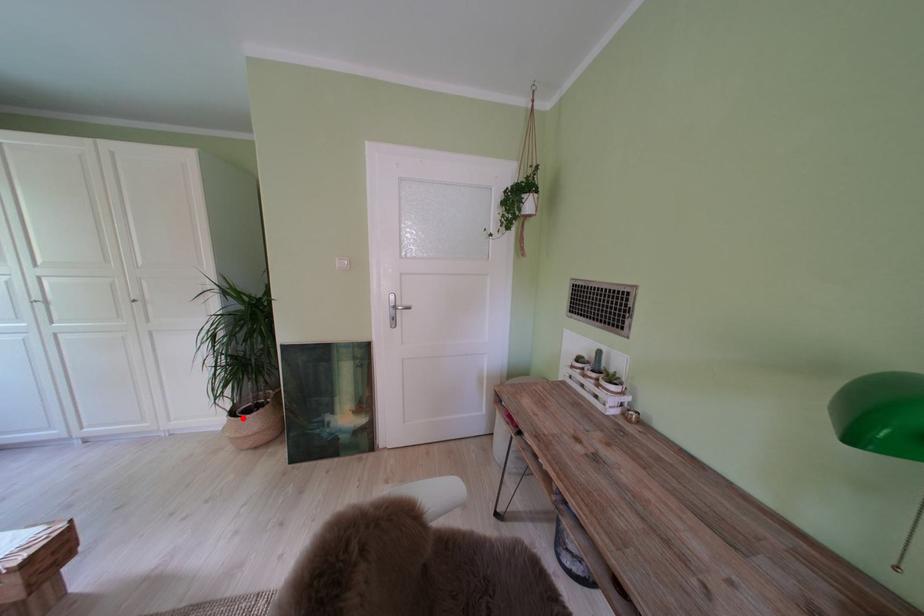
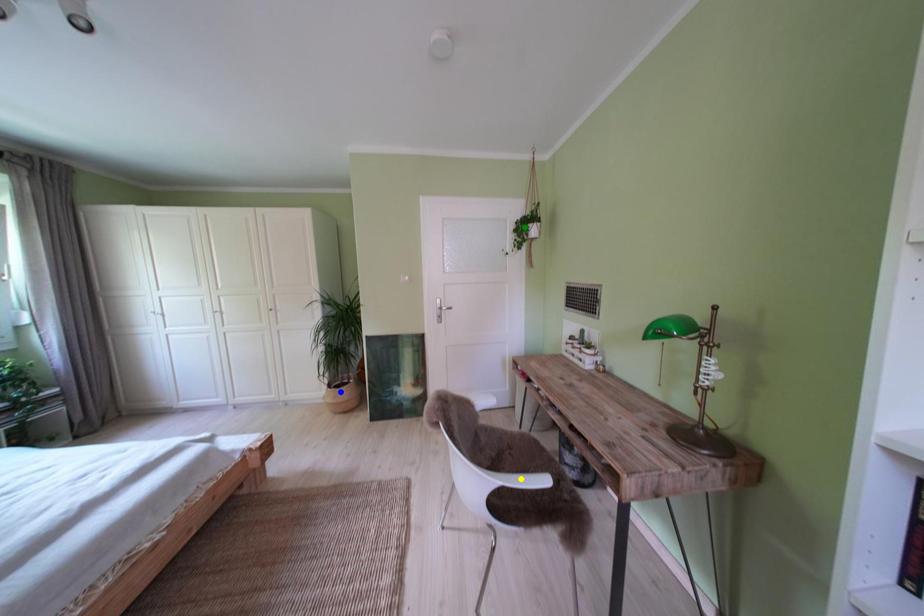
Question: I am providing you with two images of the same scene from different viewpoints. A red point is marked on the first image. You are given multiple points on the second image. Which point in image 2 is actually the same real-world point as the red point in image 1?

Choices:
 (A) green point
 (B) blue point
 (C) yellow point

Answer: (B)